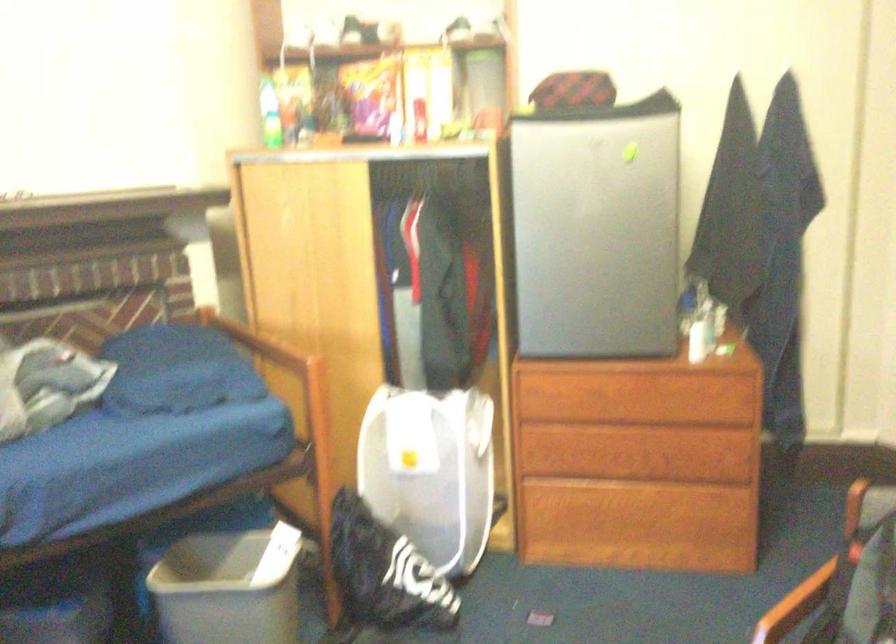
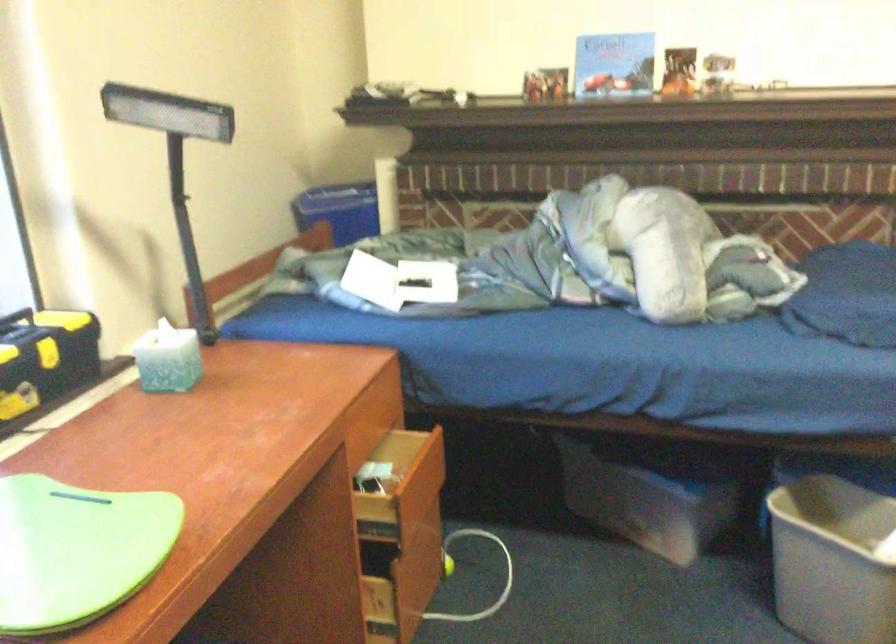
Question: The camera is either moving clockwise (left) or counter-clockwise (right) around the object. The first image is from the beginning of the video and the second image is from the end. Is the camera moving left or right when shooting the video?

Choices:
 (A) Left
 (B) Right

Answer: (B)